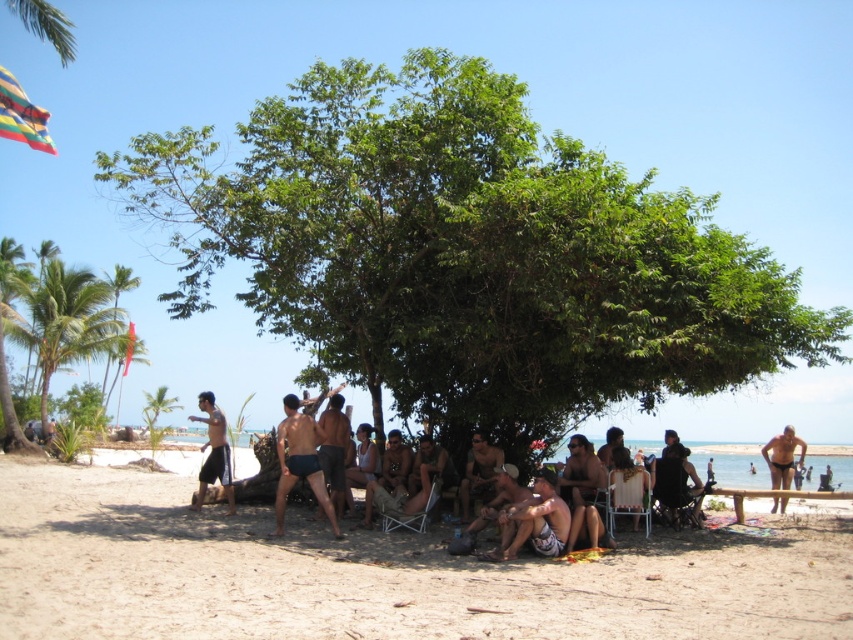
Question: Does matte brown shorts at center have a lesser width compared to matte black shorts at left?

Choices:
 (A) yes
 (B) no

Answer: (A)

Question: Which point appears closest to the camera in this image?

Choices:
 (A) (209, 481)
 (B) (396, 436)
 (C) (570, 529)

Answer: (C)

Question: Which object appears farthest from the camera in this image?

Choices:
 (A) metallic silver beach chair at center
 (B) matte black shorts at center
 (C) dark blue swim trunks at center
 (D) brown sandy beach at lower center

Answer: (A)

Question: Can you confirm if tan skin man at center is positioned to the left of smooth tan skin at center?

Choices:
 (A) no
 (B) yes

Answer: (A)

Question: Based on their relative distances, which object is farther from the smooth tan skin at center?

Choices:
 (A) tan skin man at center
 (B) smooth tan shorts at center
 (C) dark blue swim trunks at center
 (D) matte black shorts at lower right

Answer: (D)

Question: Can you confirm if green leafy tree at upper center is positioned above matte black shorts at lower right?

Choices:
 (A) no
 (B) yes

Answer: (B)